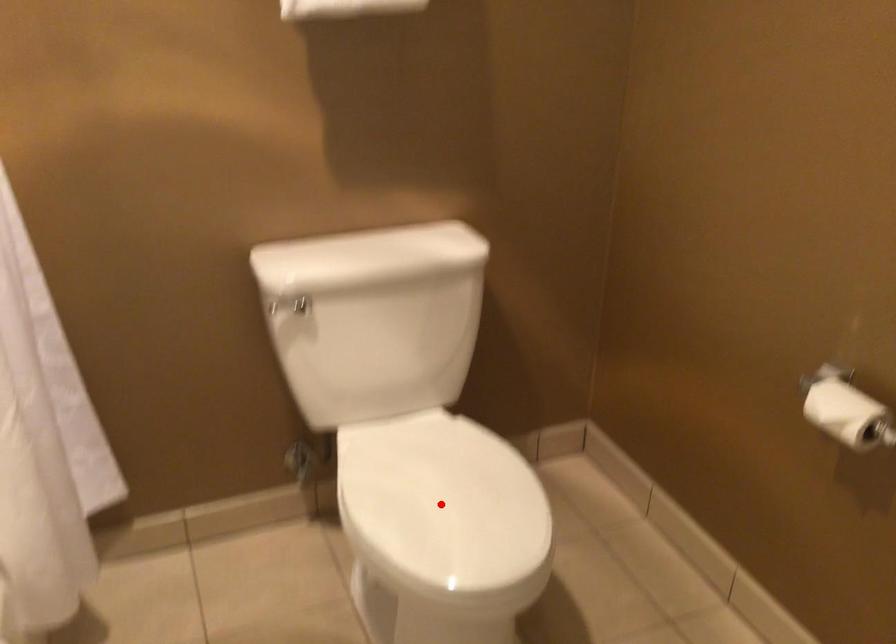
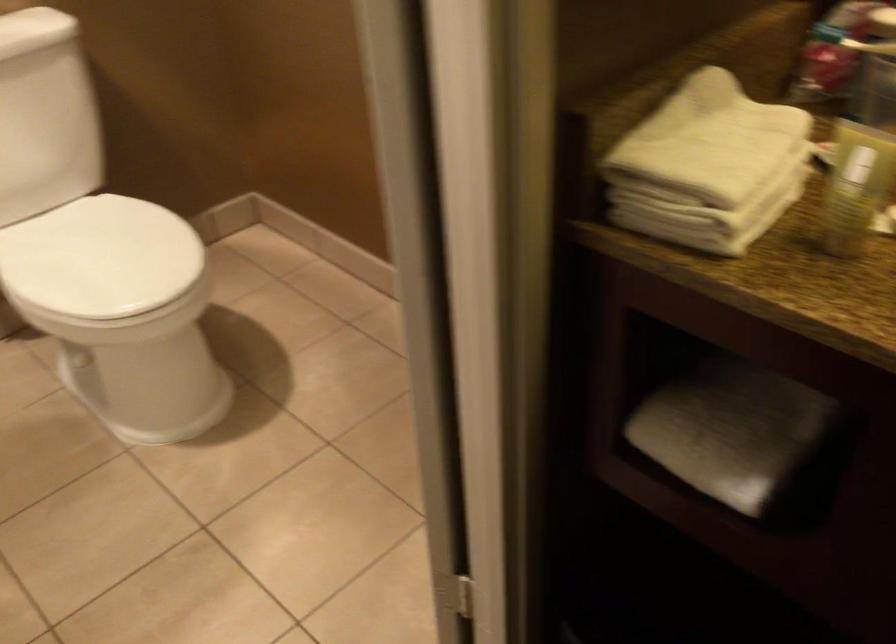
Question: I am providing you with two images of the same scene from different viewpoints. Image1 has a red point marked. In image2, the corresponding 3D location appears at what relative position? Reply with the corresponding letter.

Choices:
 (A) Closer
 (B) Farther

Answer: (B)